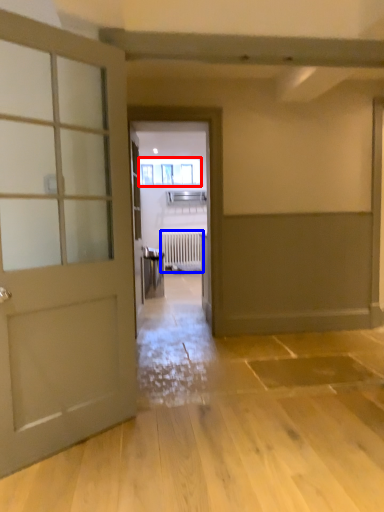
Question: Among these objects, which one is nearest to the camera, window (highlighted by a red box) or radiator (highlighted by a blue box)?

Choices:
 (A) window
 (B) radiator

Answer: (A)